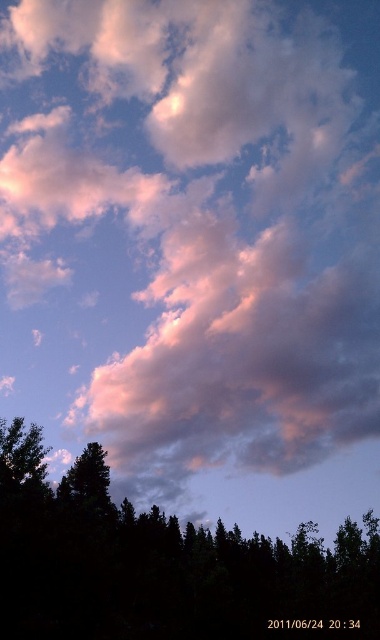
Is dark green leafy tree at bottom to the right of dark green textured tree at lower left from the viewer's perspective?

Indeed, dark green leafy tree at bottom is positioned on the right side of dark green textured tree at lower left.

Is dark green leafy tree at bottom below dark green textured tree at lower left?

Yes, dark green leafy tree at bottom is below dark green textured tree at lower left.

Is point (17, 566) less distant than point (77, 483)?

Yes, point (17, 566) is closer to viewer.

Where is `dark green leafy tree at bottom`? This screenshot has height=640, width=380. dark green leafy tree at bottom is located at coordinates (161, 563).